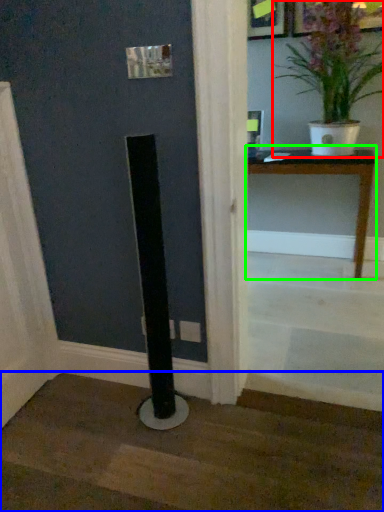
Question: Estimate the real-world distances between objects in this image. Which object is closer to houseplant (highlighted by a red box), stairwell (highlighted by a blue box) or table (highlighted by a green box)?

Choices:
 (A) stairwell
 (B) table

Answer: (B)